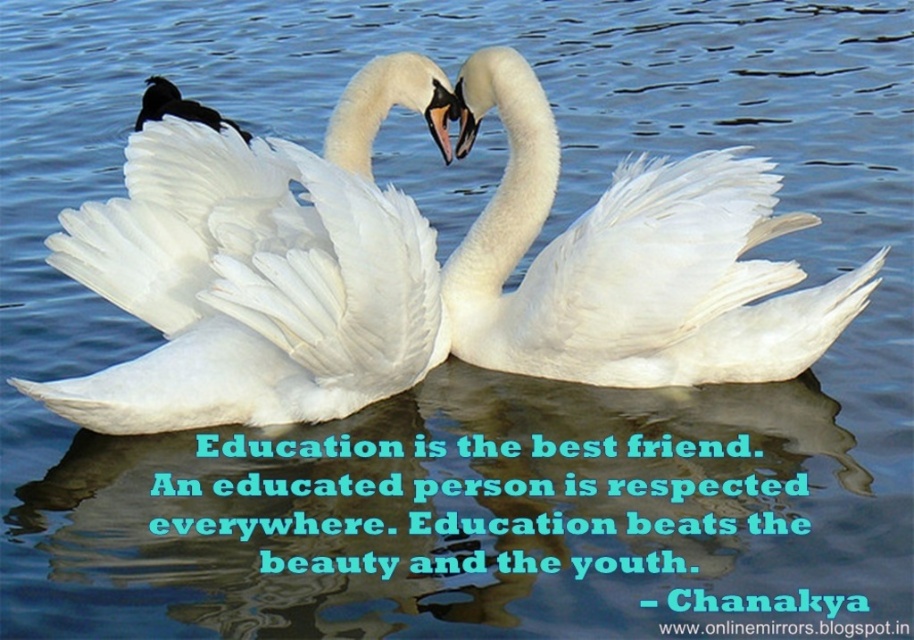
Question: Which point is farther from the camera taking this photo?

Choices:
 (A) (711, 198)
 (B) (283, 228)

Answer: (A)

Question: Which object is farther from the camera taking this photo?

Choices:
 (A) white feathered swan at center
 (B) black feathered duck at upper left

Answer: (B)

Question: Can you confirm if white feathered swan at center is smaller than black feathered duck at upper left?

Choices:
 (A) no
 (B) yes

Answer: (A)

Question: Among these objects, which one is nearest to the camera?

Choices:
 (A) white glossy swan at upper left
 (B) white feathered swan at center
 (C) black feathered duck at upper left

Answer: (A)

Question: Does white feathered swan at center come in front of white glossy swan at upper left?

Choices:
 (A) no
 (B) yes

Answer: (A)

Question: Is white glossy swan at upper left to the right of black feathered duck at upper left from the viewer's perspective?

Choices:
 (A) no
 (B) yes

Answer: (B)